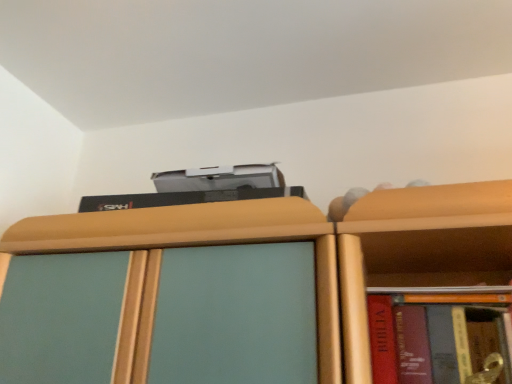
Identify the location of red leather book at lower right. (441, 338).

Describe the element at coordinates (441, 338) in the screenshot. The height and width of the screenshot is (384, 512). I see `red leather book at lower right` at that location.

Locate an element on the screen. red leather book at lower right is located at coordinates (441, 338).